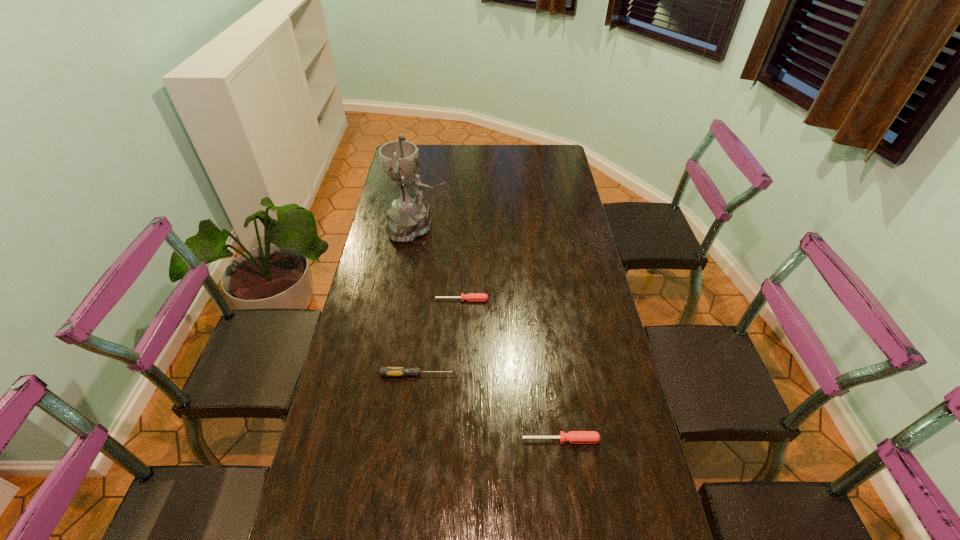
Find the location of a particular element. The image size is (960, 540). empty space that is in between the second farthest object and the third farthest object is located at coordinates (440, 338).

Where is `empty location between the farthest screwdriver and the second nearest object`? empty location between the farthest screwdriver and the second nearest object is located at coordinates (440, 338).

Where is `empty location between the farthest screwdriver and the nearest object`? The image size is (960, 540). empty location between the farthest screwdriver and the nearest object is located at coordinates (512, 370).

Identify the location of vacant region between the third farthest object and the farthest object. (418, 301).

You are a GUI agent. You are given a task and a screenshot of the screen. Output one action in this format:
    pyautogui.click(x=<x>, y=<y>)
    Task: Click on the free space between the rightmost screwdriver and the farthest object
    This screenshot has width=960, height=540.
    Given the screenshot: What is the action you would take?
    pyautogui.click(x=490, y=334)

I want to click on free spot between the farthest screwdriver and the farthest object, so click(440, 264).

Find the location of a particular element. object that can be found as the closest to the rightmost object is located at coordinates (384, 371).

Locate which object is the closest to the farthest screwdriver. Please provide its 2D coordinates. Your answer should be formatted as a tuple, i.e. [(x, y)], where the tuple contains the x and y coordinates of a point satisfying the conditions above.

[(407, 219)]

Locate an element on the screen. screwdriver that is the closest one to the second nearest object is located at coordinates (574, 437).

Locate which screwdriver is the second closest to the nearest object. Please provide its 2D coordinates. Your answer should be formatted as a tuple, i.e. [(x, y)], where the tuple contains the x and y coordinates of a point satisfying the conditions above.

[(470, 296)]